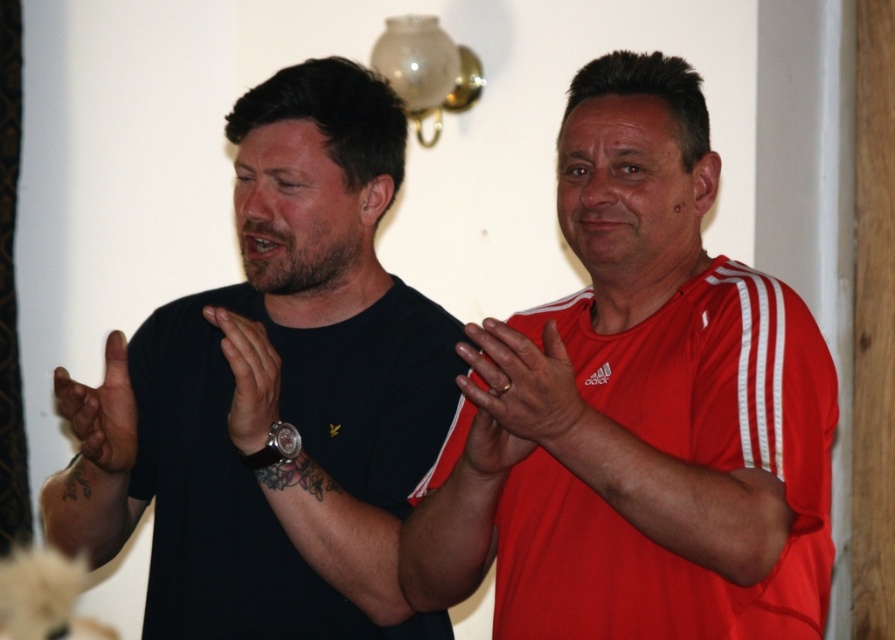
In the scene shown: Who is shorter, red matte shirt at right or black leather watch at center?

black leather watch at center is shorter.

Looking at this image, which of these two, red matte shirt at right or black leather watch at center, stands taller?

Standing taller between the two is red matte shirt at right.

This screenshot has width=895, height=640. In order to click on red matte shirt at right in this screenshot , I will do `click(604, 465)`.

Is black matte t-shirt at left below black leather watch at center?

Incorrect, black matte t-shirt at left is not positioned below black leather watch at center.

The height and width of the screenshot is (640, 895). What do you see at coordinates (286, 392) in the screenshot?
I see `black matte t-shirt at left` at bounding box center [286, 392].

In order to click on black matte t-shirt at left in this screenshot , I will do `click(286, 392)`.

Does black matte wristwatch at left appear over black leather watch at center?

Actually, black matte wristwatch at left is below black leather watch at center.

Measure the distance from black matte wristwatch at left to black leather watch at center.

The distance of black matte wristwatch at left from black leather watch at center is 9.66 inches.

This screenshot has height=640, width=895. Describe the element at coordinates (94, 461) in the screenshot. I see `black matte wristwatch at left` at that location.

Find the location of a particular element. black matte wristwatch at left is located at coordinates [x=94, y=461].